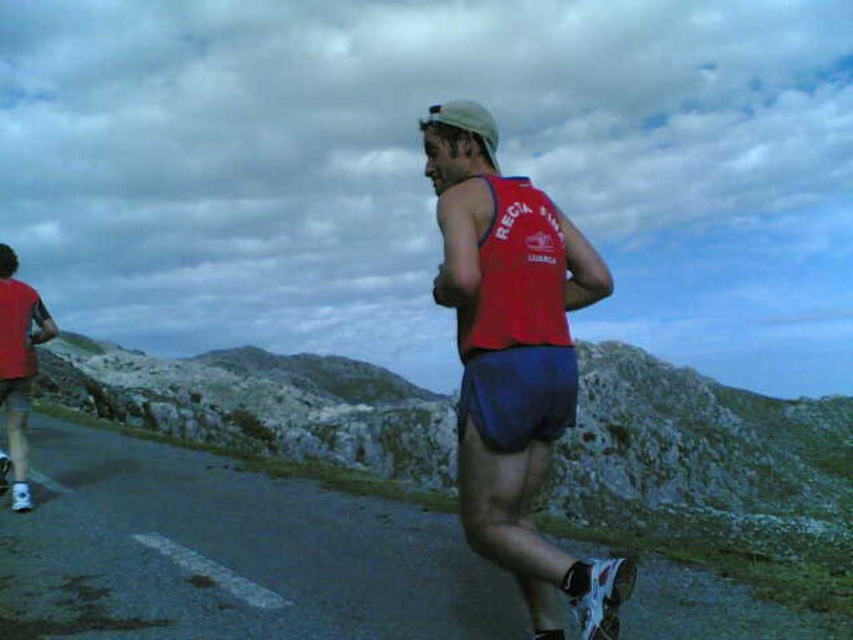
You are a runner preparing to start a race on the dark asphalt road at center. The starting line is at point A, and the finish line is at point B. If the point B is located at the coordinates given by the point in the image, which is point (229,554), where should you aim to run towards to reach the finish line?

The finish line is at the coordinates specified by point (229,554), so you should aim to run towards the dark asphalt road at center where the point is located to reach the finish line.

You are a runner preparing to place a marker at two specific points on the road. The first point is labeled as point (283, 600) and the second point is labeled as point (584, 576). Which point is closer to your current position?

Point (283, 600) is closer to your current position because it is further to the viewer than point (584, 576).